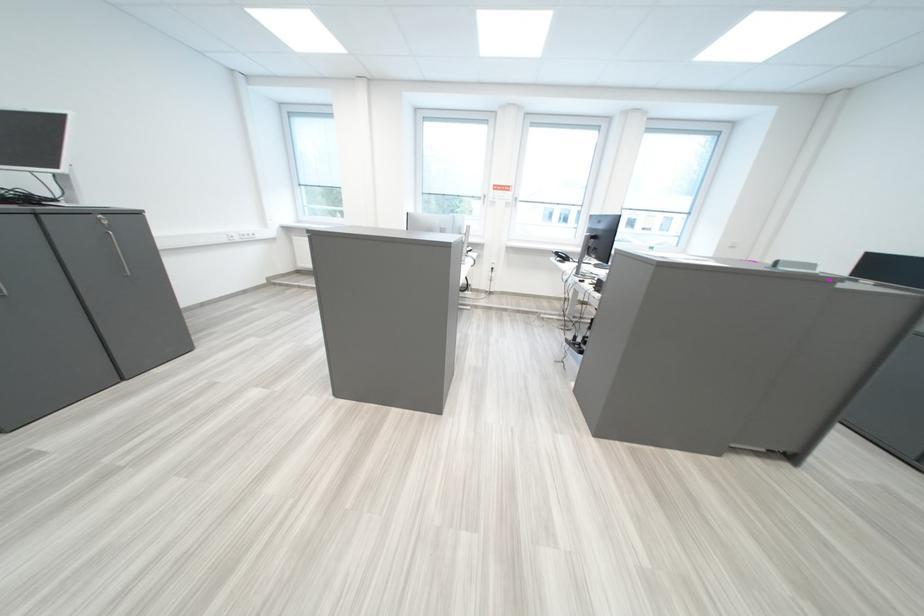
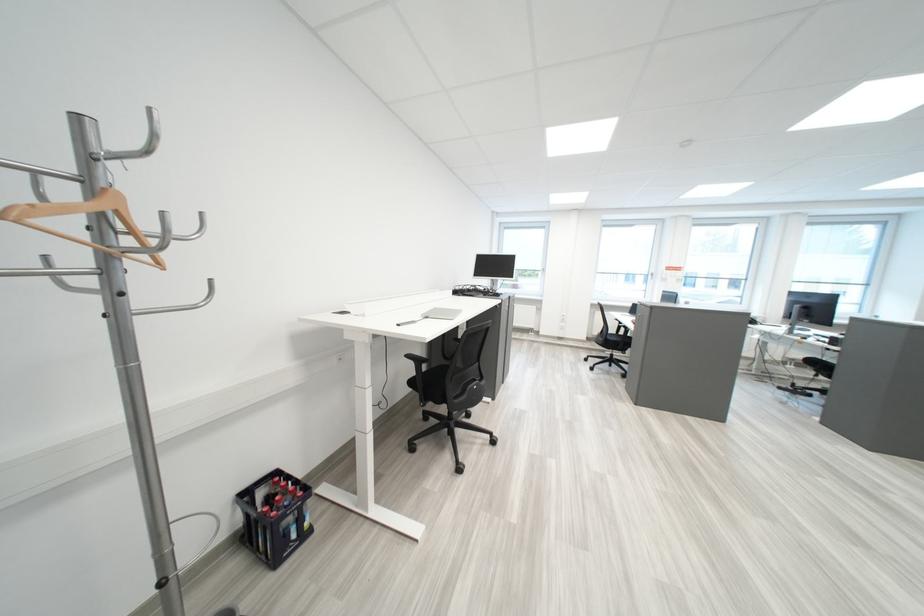
What movement of the cameraman would produce the second image?

The cameraman moved toward left, backward.